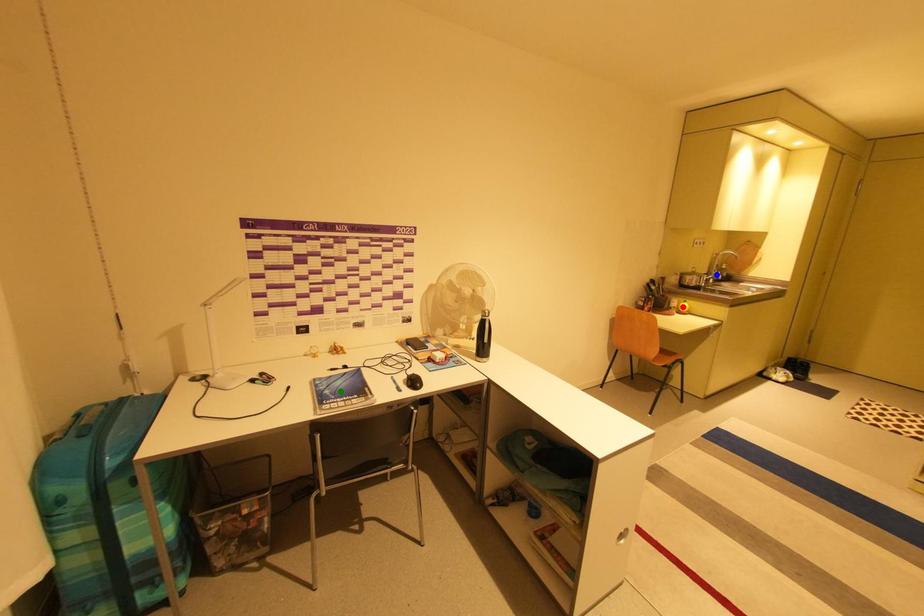
Order these from nearest to farthest:
- blue point
- red point
- green point

green point < red point < blue point